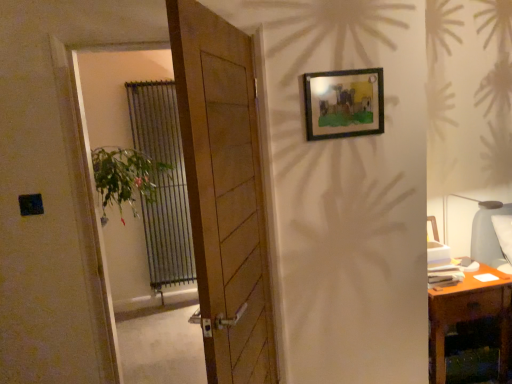
Question: Could wooden door at center be considered to be inside wooden desk at right?

Choices:
 (A) yes
 (B) no

Answer: (B)

Question: Does wooden desk at right have a greater height compared to wooden door at center?

Choices:
 (A) yes
 (B) no

Answer: (B)

Question: From the image's perspective, is wooden desk at right below wooden door at center?

Choices:
 (A) no
 (B) yes

Answer: (B)

Question: From the image's perspective, does wooden desk at right appear higher than wooden door at center?

Choices:
 (A) no
 (B) yes

Answer: (A)

Question: From a real-world perspective, does wooden desk at right stand above wooden door at center?

Choices:
 (A) yes
 (B) no

Answer: (B)

Question: Considering the relative sizes of wooden desk at right and wooden door at center in the image provided, is wooden desk at right shorter than wooden door at center?

Choices:
 (A) yes
 (B) no

Answer: (A)

Question: Is the depth of wooden frame at upper right greater than that of wooden desk at right?

Choices:
 (A) yes
 (B) no

Answer: (B)

Question: From the image's perspective, is wooden frame at upper right located beneath wooden desk at right?

Choices:
 (A) no
 (B) yes

Answer: (A)

Question: Is wooden frame at upper right at the right side of wooden desk at right?

Choices:
 (A) no
 (B) yes

Answer: (A)

Question: Is wooden frame at upper right facing towards wooden desk at right?

Choices:
 (A) no
 (B) yes

Answer: (A)

Question: Does wooden frame at upper right have a greater width compared to wooden desk at right?

Choices:
 (A) no
 (B) yes

Answer: (A)

Question: Considering the relative sizes of wooden frame at upper right and wooden desk at right in the image provided, is wooden frame at upper right taller than wooden desk at right?

Choices:
 (A) yes
 (B) no

Answer: (B)

Question: Is the position of metallic silver radiator at left more distant than that of wooden desk at right?

Choices:
 (A) no
 (B) yes

Answer: (B)